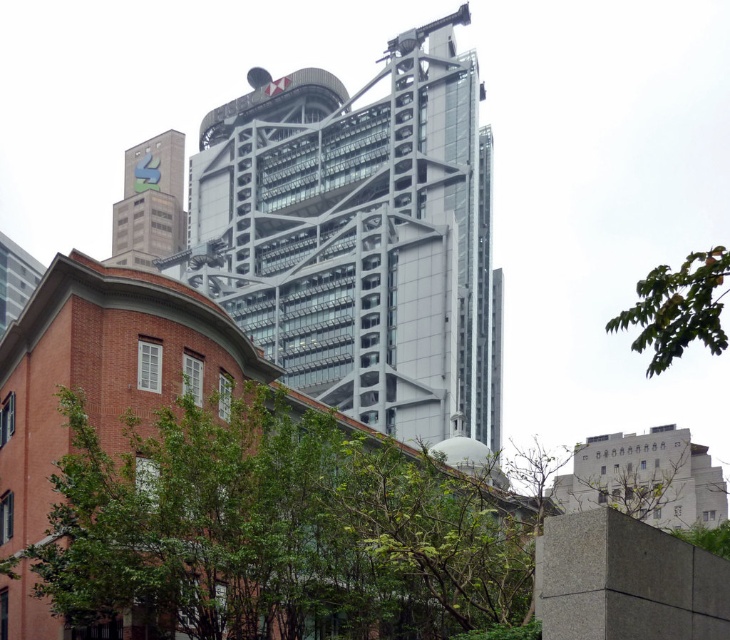
You are a city planner assessing the distance between the two green leafy trees in the urban scene. Given that the minimum required distance between trees for proper growth is 50 feet, can the green leafy tree at lower left and the green leafy tree at upper right meet this requirement?

The green leafy tree at lower left is 51.49 feet away from the green leafy tree at upper right, which exceeds the minimum required distance of 50 feet. Therefore, they meet the growth requirement.

Based on the photo, you are standing in the urban area shown in the image. There is a point marked at coordinates (677, 308). What object does this point correspond to?

The point at coordinates (677, 308) corresponds to the green leafy tree at upper right.